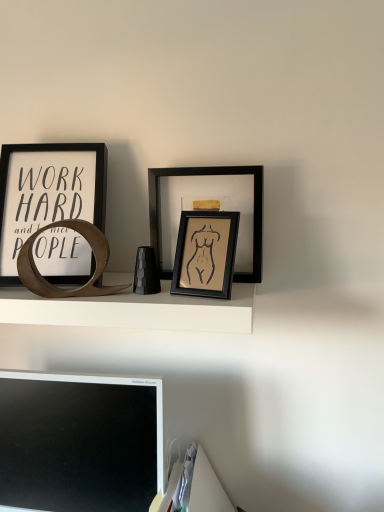
Question: Is matte black picture frame at center, arranged as the second picture frame when viewed from the right, smaller than black matte computer monitor at lower left?

Choices:
 (A) yes
 (B) no

Answer: (A)

Question: Is matte black picture frame at center, positioned as the 2th picture frame in left-to-right order, shorter than black matte computer monitor at lower left?

Choices:
 (A) yes
 (B) no

Answer: (A)

Question: Is matte black picture frame at center, positioned as the 2th picture frame in left-to-right order, bigger than black matte computer monitor at lower left?

Choices:
 (A) no
 (B) yes

Answer: (A)

Question: Is matte black picture frame at center, positioned as the 2th picture frame in left-to-right order, behind black matte computer monitor at lower left?

Choices:
 (A) no
 (B) yes

Answer: (A)

Question: From the image's perspective, is matte black picture frame at center, arranged as the second picture frame when viewed from the right, below black matte computer monitor at lower left?

Choices:
 (A) yes
 (B) no

Answer: (B)

Question: Is the depth of matte black picture frame at center, arranged as the second picture frame when viewed from the right, less than that of black matte computer monitor at lower left?

Choices:
 (A) no
 (B) yes

Answer: (B)

Question: Considering the relative sizes of matte black picture frame at center, arranged as the second picture frame when viewed from the right, and matte black picture frame at center, acting as the first picture frame starting from the right, in the image provided, is matte black picture frame at center, arranged as the second picture frame when viewed from the right, bigger than matte black picture frame at center, acting as the first picture frame starting from the right,?

Choices:
 (A) yes
 (B) no

Answer: (B)

Question: Is matte black picture frame at center, positioned as the 2th picture frame in left-to-right order, positioned before matte black picture frame at center, which ranks as the 3th picture frame in left-to-right order?

Choices:
 (A) no
 (B) yes

Answer: (B)

Question: Can you confirm if matte black picture frame at center, positioned as the 2th picture frame in left-to-right order, is taller than matte black picture frame at center, which ranks as the 3th picture frame in left-to-right order?

Choices:
 (A) no
 (B) yes

Answer: (A)

Question: Would you say matte black picture frame at center, positioned as the 2th picture frame in left-to-right order, contains matte black picture frame at center, acting as the first picture frame starting from the right?

Choices:
 (A) no
 (B) yes

Answer: (A)

Question: Does matte black picture frame at center, arranged as the second picture frame when viewed from the right, have a smaller size compared to matte black picture frame at center, which ranks as the 3th picture frame in left-to-right order?

Choices:
 (A) no
 (B) yes

Answer: (B)

Question: Considering the relative positions of matte black picture frame at center, positioned as the 2th picture frame in left-to-right order, and matte black picture frame at center, acting as the first picture frame starting from the right, in the image provided, is matte black picture frame at center, positioned as the 2th picture frame in left-to-right order, to the right of matte black picture frame at center, acting as the first picture frame starting from the right, from the viewer's perspective?

Choices:
 (A) yes
 (B) no

Answer: (B)

Question: Does matte black picture frame at center, acting as the first picture frame starting from the right, lie in front of black matte computer monitor at lower left?

Choices:
 (A) yes
 (B) no

Answer: (B)